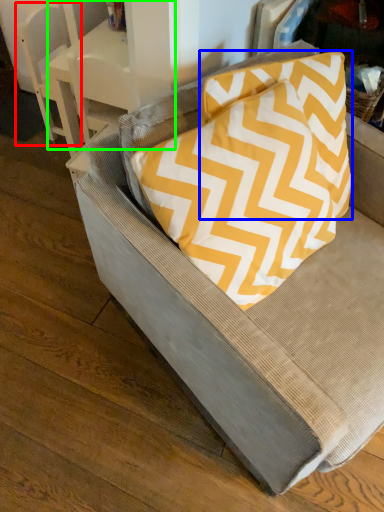
Question: Estimate the real-world distances between objects in this image. Which object is farther from armchair (highlighted by a red box), pillow (highlighted by a blue box) or table (highlighted by a green box)?

Choices:
 (A) pillow
 (B) table

Answer: (A)